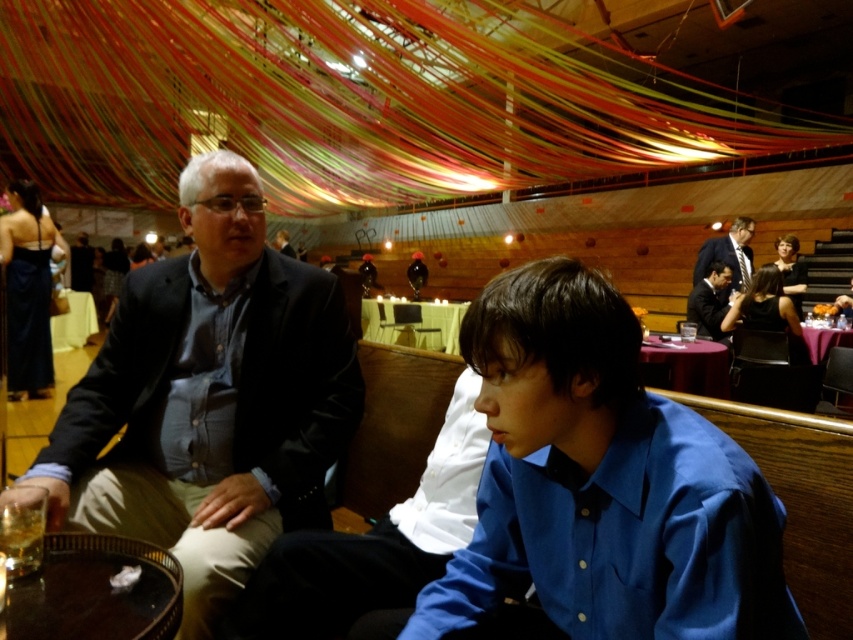
Who is positioned more to the right, white cloth-covered table at center or white cloth at left?

From the viewer's perspective, white cloth-covered table at center appears more on the right side.

Between point (445, 317) and point (71, 324), which one is positioned in front?

Point (71, 324)

Which is behind, point (374, 308) or point (70, 324)?

Positioned behind is point (374, 308).

Locate an element on the screen. The image size is (853, 640). white cloth-covered table at center is located at coordinates (412, 323).

Does smooth red table at lower right have a larger size compared to matte black suit at upper right?

No.

This screenshot has width=853, height=640. Identify the location of smooth red table at lower right. (686, 365).

At what (x,y) coordinates should I click in order to perform the action: click on smooth red table at lower right. Please return your answer as a coordinate pair (x, y). Looking at the image, I should click on (686, 365).

Looking at this image, is white cloth at left to the right of pink satin tablecloth at lower right from the viewer's perspective?

No, white cloth at left is not to the right of pink satin tablecloth at lower right.

Between point (90, 317) and point (827, 337), which one is positioned in front?

Point (827, 337) is more forward.

The height and width of the screenshot is (640, 853). What are the coordinates of `white cloth at left` in the screenshot? It's located at (73, 321).